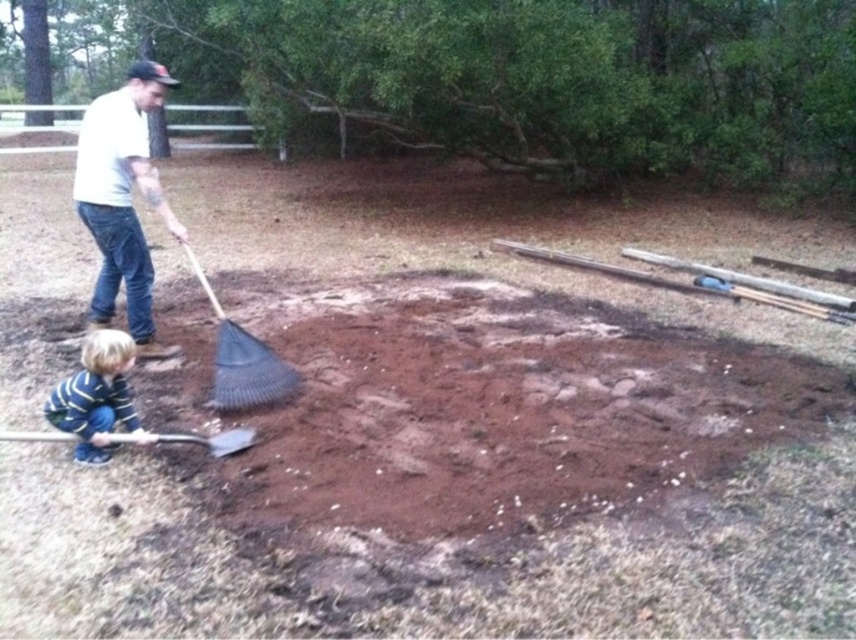
Question: Which object appears closest to the camera in this image?

Choices:
 (A) wooden shovel at lower left
 (B) striped cotton shirt at lower left
 (C) black plastic rake at center
 (D) white matte shirt at upper left

Answer: (A)

Question: Among these points, which one is nearest to the camera?

Choices:
 (A) (131, 412)
 (B) (235, 362)

Answer: (A)

Question: Is the position of white matte shirt at upper left more distant than that of striped cotton shirt at lower left?

Choices:
 (A) yes
 (B) no

Answer: (A)

Question: Does striped cotton shirt at lower left have a larger size compared to black plastic rake at center?

Choices:
 (A) no
 (B) yes

Answer: (A)

Question: Can you confirm if striped cotton shirt at lower left is smaller than black plastic rake at center?

Choices:
 (A) yes
 (B) no

Answer: (A)

Question: Which point is farther to the camera?

Choices:
 (A) (275, 356)
 (B) (131, 129)
 (C) (134, 356)

Answer: (A)